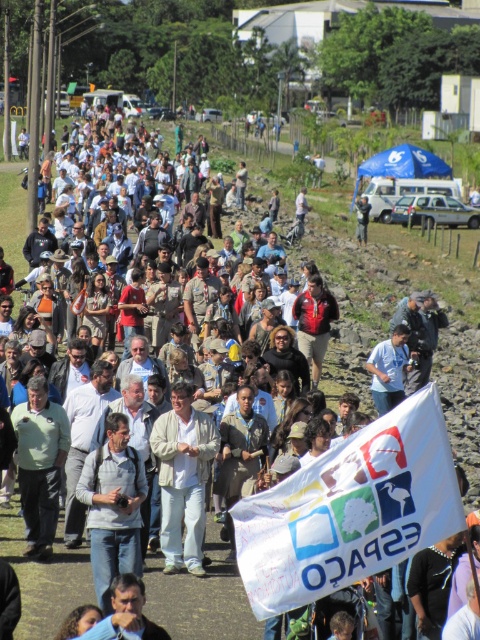
You are a photographer standing at the back of the crowd capturing the event. You want to take a photo that includes both the white cotton shirt at center and the dark blue shirt at center. Given that your camera has a maximum focus range of 100 feet, will you be able to capture both shirts in focus without moving closer?

The distance between the white cotton shirt at center and the dark blue shirt at center is 130.36 feet. Since your camera can only focus up to 100 feet, capturing both shirts in focus without moving closer would not be possible.

You are standing in the crowd and see both the white cotton shirt at center and the dark blue shirt at center. Which one is positioned more to the left?

The white cotton shirt at center is positioned to the left of the dark blue shirt at center, so the white cotton shirt at center is more to the left.

You are a photographer trying to capture a clear photo of the white cotton shirt at center and the dark blue shirt at center. Which shirt should you focus on to ensure both are in focus?

You should focus on the white cotton shirt at center because it is closer to the viewer than the dark blue shirt at center, so focusing on it will keep both shirts in focus.